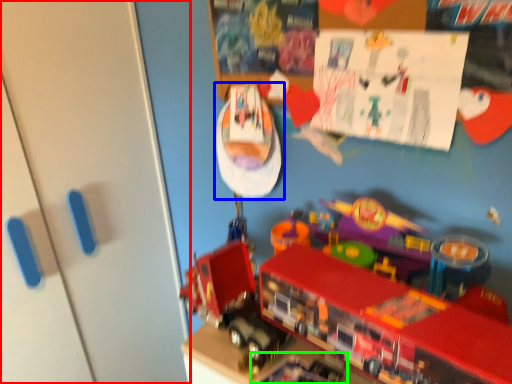
Question: Estimate the real-world distances between objects in this image. Which object is farther from door (highlighted by a red box), toy (highlighted by a blue box) or toy (highlighted by a green box)?

Choices:
 (A) toy
 (B) toy

Answer: (B)